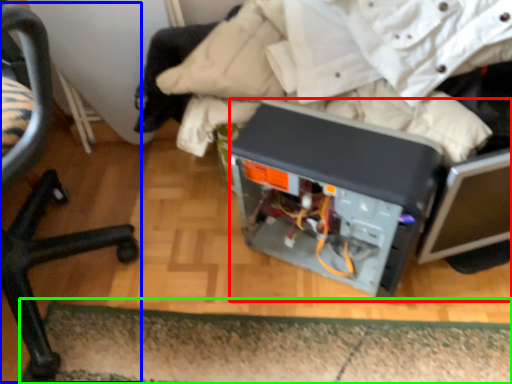
Question: Which object is the closest to the wide (highlighted by a red box)? Choose among these: chair (highlighted by a blue box) or doormat (highlighted by a green box).

Choices:
 (A) chair
 (B) doormat

Answer: (B)